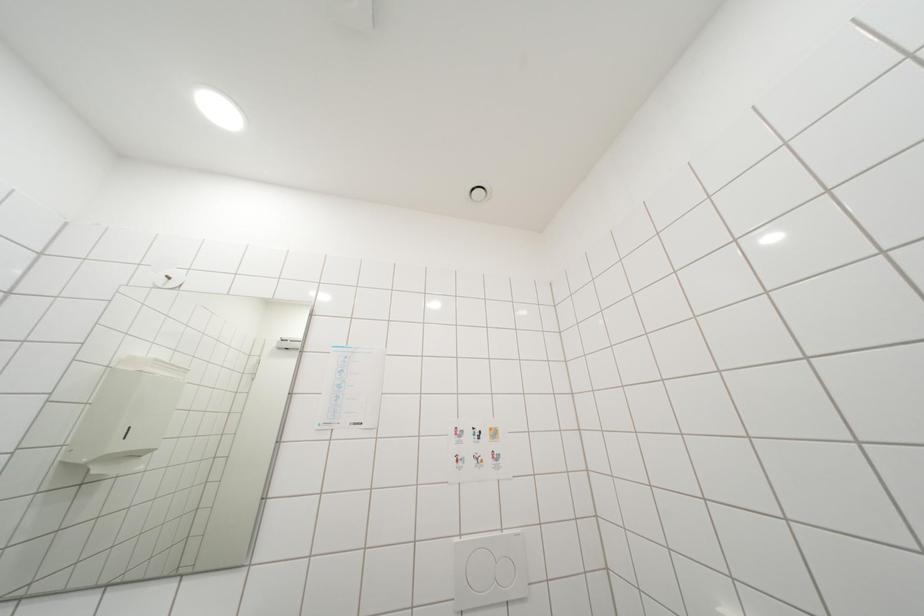
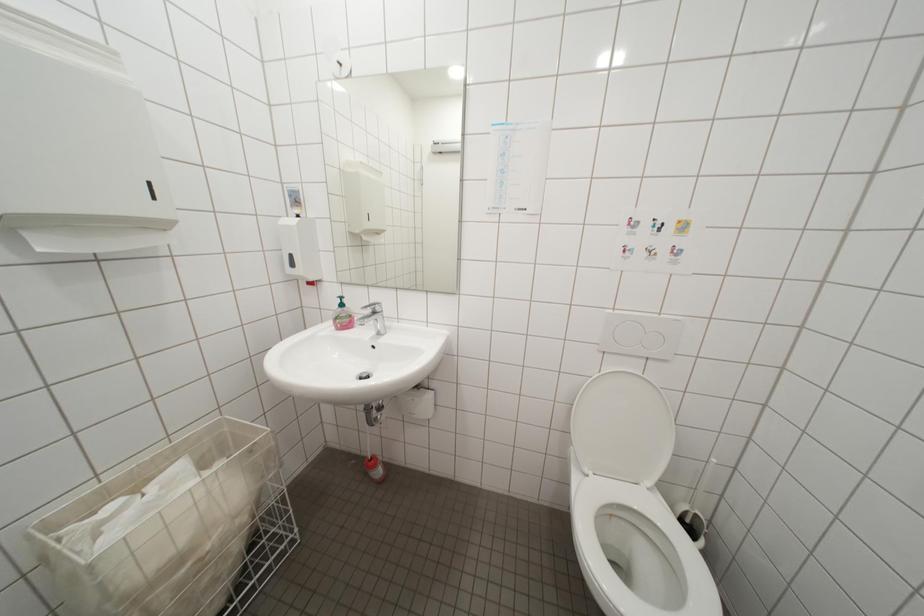
First-person continuous shooting, in which direction is the camera rotating?

The rotation direction of the camera is left-down.